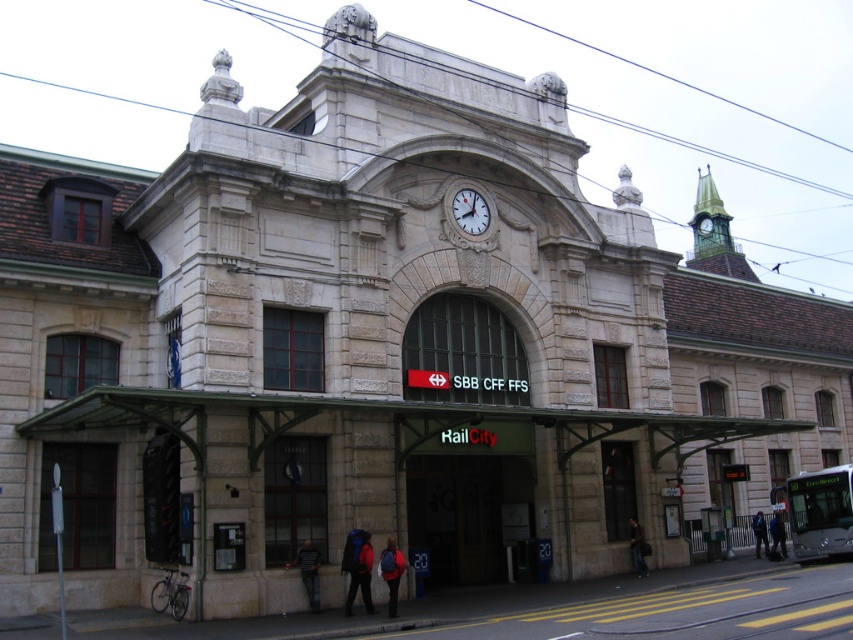
Question: Estimate the real-world distances between objects in this image. Which object is farther from the stone railway station at center?

Choices:
 (A) green metal clock tower at upper right
 (B) glass door at center
 (C) dark gray jeans at lower center

Answer: (A)

Question: Estimate the real-world distances between objects in this image. Which object is farther from the dark gray jeans at lower center?

Choices:
 (A) glass door at center
 (B) matte glass door at center

Answer: (A)

Question: Estimate the real-world distances between objects in this image. Which object is farther from the matte black backpack at lower center?

Choices:
 (A) stone railway station at center
 (B) dark blue backpack at center

Answer: (B)

Question: Can you confirm if matte glass door at center is smaller than dark gray jeans at lower center?

Choices:
 (A) no
 (B) yes

Answer: (B)

Question: Does glass door at center have a greater width compared to blue fabric jacket at lower right?

Choices:
 (A) no
 (B) yes

Answer: (B)

Question: Considering the relative positions of glass door at center and dark blue backpack at center in the image provided, where is glass door at center located with respect to dark blue backpack at center?

Choices:
 (A) below
 (B) above

Answer: (B)